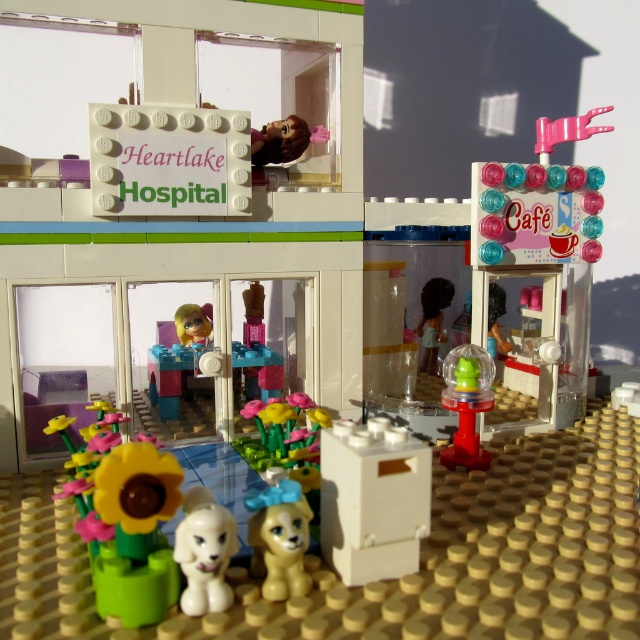
Question: Does white plastic microwave at center appear under translucent green plastic toy at center?

Choices:
 (A) yes
 (B) no

Answer: (A)

Question: Is light brown plush dog at center below floral-patterned plastic flowers at center?

Choices:
 (A) no
 (B) yes

Answer: (B)

Question: Which of these objects is positioned farthest from the white glossy dog at lower center?

Choices:
 (A) floral-patterned plastic flowers at center
 (B) white plastic microwave at center
 (C) light brown plush dog at center

Answer: (A)

Question: Considering the relative positions of light brown plush dog at center and translucent green plastic toy at center in the image provided, where is light brown plush dog at center located with respect to translucent green plastic toy at center?

Choices:
 (A) right
 (B) left

Answer: (B)

Question: Considering the real-world distances, which object is closest to the light brown plush dog at center?

Choices:
 (A) white plastic microwave at center
 (B) plastic sunflower at lower left
 (C) translucent green plastic toy at center
 (D) floral-patterned plastic flowers at center

Answer: (A)

Question: Which of these objects is positioned closest to the light brown plush dog at center?

Choices:
 (A) white glossy dog at lower center
 (B) plastic sunflower at lower left

Answer: (A)